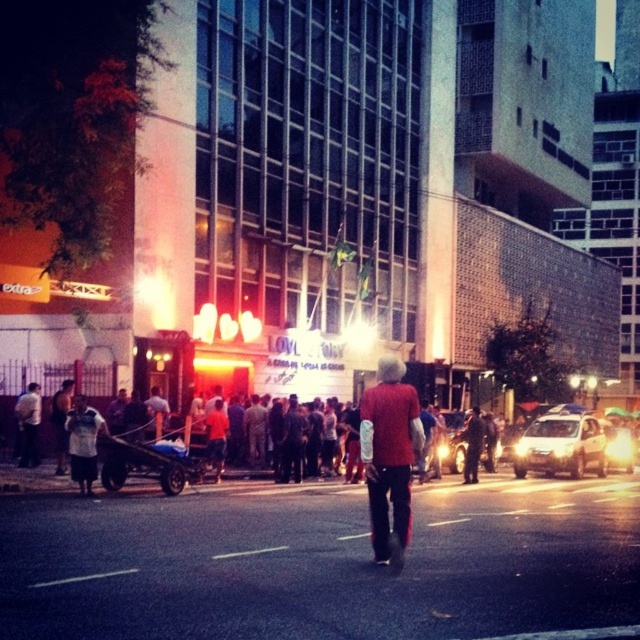
Question: Does matte red sweater at center have a smaller size compared to white cotton shirt at lower left?

Choices:
 (A) no
 (B) yes

Answer: (A)

Question: Which object appears farthest from the camera in this image?

Choices:
 (A) matte red sweater at center
 (B) shiny silver sedan at center

Answer: (B)

Question: Is matte red sweater at center to the left of silver metallic sedan at center from the viewer's perspective?

Choices:
 (A) yes
 (B) no

Answer: (A)

Question: Does white cotton shirt at lower left lie behind shiny silver sedan at center?

Choices:
 (A) yes
 (B) no

Answer: (B)

Question: Which point is closer to the camera taking this photo?

Choices:
 (A) tap(486, 452)
 (B) tap(554, 461)
 (C) tap(392, 465)
 (D) tap(83, 490)

Answer: (C)

Question: Which object is the farthest from the silver metallic sedan at center?

Choices:
 (A) white cotton shirt at lower left
 (B) matte red sweater at center

Answer: (A)